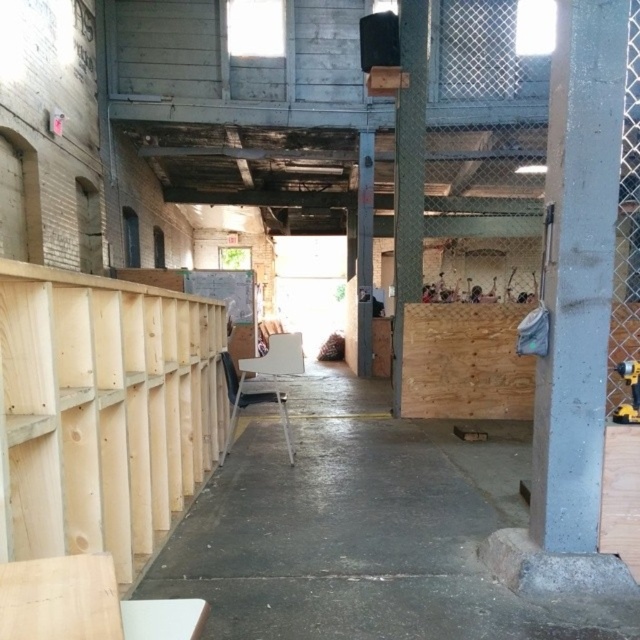
Question: Is gray concrete pillar at center bigger than metallic yellow drill at right?

Choices:
 (A) yes
 (B) no

Answer: (A)

Question: Which is farther from the gray concrete pillar at center?

Choices:
 (A) gray concrete pillar at right
 (B) metallic yellow drill at right

Answer: (B)

Question: Which object appears farthest from the camera in this image?

Choices:
 (A) gray concrete pillar at right
 (B) gray concrete at center
 (C) gray concrete pillar at center
 (D) wooden at right

Answer: (C)

Question: Does gray concrete at center appear on the right side of wooden at right?

Choices:
 (A) no
 (B) yes

Answer: (A)

Question: Among these objects, which one is nearest to the camera?

Choices:
 (A) gray concrete at center
 (B) wooden at right

Answer: (A)

Question: Can you confirm if gray concrete at center is positioned above metallic yellow drill at right?

Choices:
 (A) no
 (B) yes

Answer: (A)